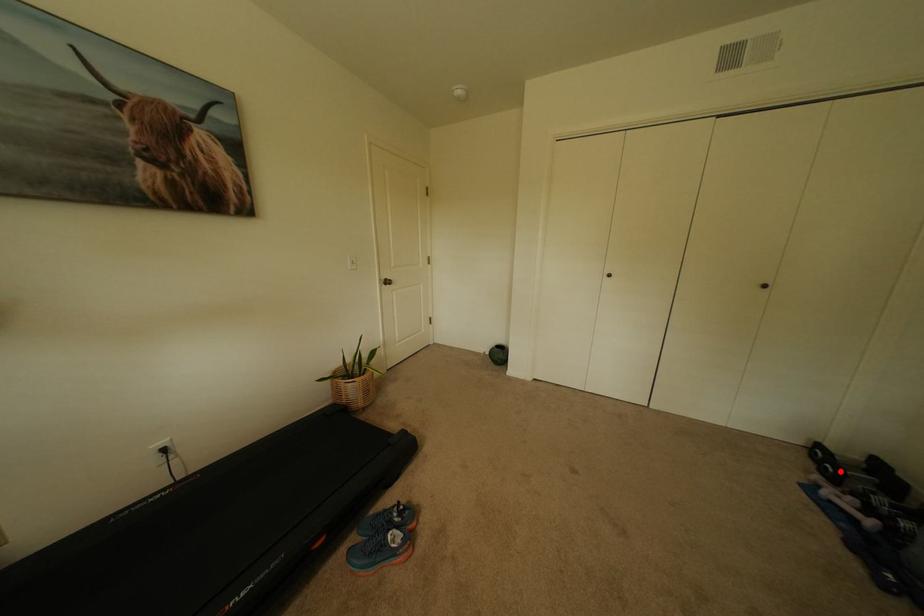
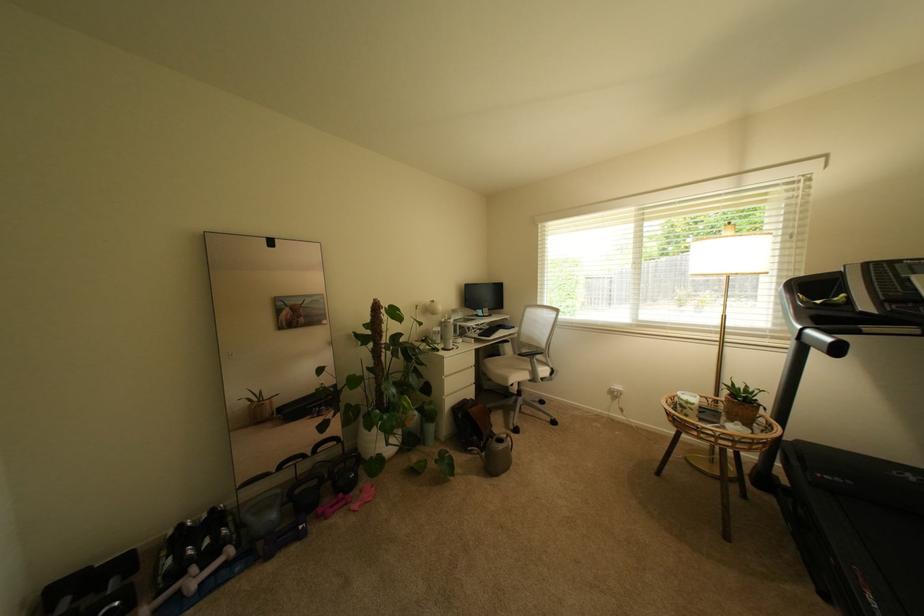
Question: I am providing you with two images of the same scene from different viewpoints. Image1 has a red point marked. In image2, the corresponding 3D location appears at what relative position? Reply with the corresponding letter.

Choices:
 (A) Closer
 (B) Farther

Answer: (A)